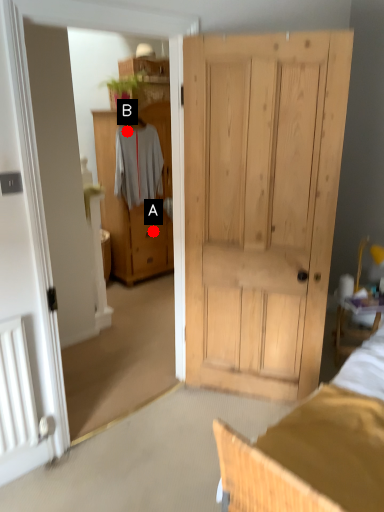
Question: Two points are circled on the image, labeled by A and B beside each circle. Which of the following is the closest to the observer?

Choices:
 (A) A is closer
 (B) B is closer

Answer: (B)